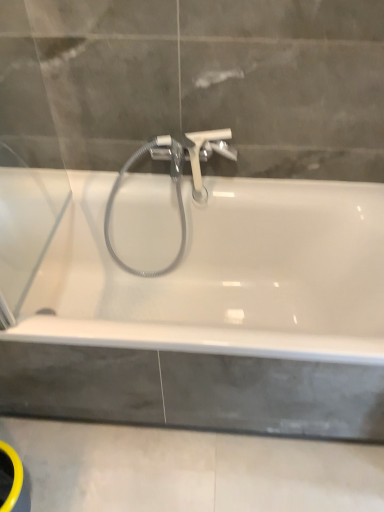
This screenshot has width=384, height=512. Describe the element at coordinates (208, 309) in the screenshot. I see `white glossy bathtub at center` at that location.

Describe the element at coordinates (190, 469) in the screenshot. I see `concreteroughbath edge at lower center` at that location.

The image size is (384, 512). I want to click on white glossy bathtub at center, so click(208, 309).

Is white glossy bathtub at center turned away from white plastic tap at center?

That's not correct — white glossy bathtub at center is not looking away from white plastic tap at center.

How far apart are white glossy bathtub at center and white plastic tap at center?

white glossy bathtub at center and white plastic tap at center are 45.91 centimeters apart from each other.

Is white glossy bathtub at center surrounding white plastic tap at center?

That's incorrect, white plastic tap at center is not inside white glossy bathtub at center.

From a real-world perspective, between white glossy bathtub at center and white plastic tap at center, who is vertically higher?

white plastic tap at center, from a real-world perspective.

Is concreteroughbath edge at lower center far from white plastic tap at center?

concreteroughbath edge at lower center is actually quite close to white plastic tap at center.

You are a GUI agent. You are given a task and a screenshot of the screen. Output one action in this format:
    pyautogui.click(x=<x>, y=<y>)
    Task: Click on the tap located behind the concreteroughbath edge at lower center
    
    Given the screenshot: What is the action you would take?
    pyautogui.click(x=194, y=153)

Measure the distance between concreteroughbath edge at lower center and white plastic tap at center.

concreteroughbath edge at lower center and white plastic tap at center are 36.32 inches apart from each other.

From the image's perspective, between concreteroughbath edge at lower center and white plastic tap at center, who is located below?

From the image's view, concreteroughbath edge at lower center is below.

Which is closer to the camera, (223, 139) or (194, 420)?

The point (194, 420) is closer to the camera.

Is white plastic tap at center not within white glossy bathtub at center?

white plastic tap at center lies outside white glossy bathtub at center's area.

How many degrees apart are the facing directions of white plastic tap at center and white glossy bathtub at center?

The facing directions of white plastic tap at center and white glossy bathtub at center are 3.67 degrees apart.

Considering the sizes of objects white plastic tap at center and white glossy bathtub at center in the image provided, who is thinner, white plastic tap at center or white glossy bathtub at center?

With smaller width is white plastic tap at center.

Is white glossy bathtub at center wider than concreteroughbath edge at lower center?

No, white glossy bathtub at center is not wider than concreteroughbath edge at lower center.

From the image's perspective, which one is positioned higher, white glossy bathtub at center or concreteroughbath edge at lower center?

From the image's view, white glossy bathtub at center is above.

Find the location of a particular element. concrete below the white plastic tap at center (from a real-world perspective) is located at coordinates (190, 469).

Which is in front, point (190, 139) or point (162, 473)?

The point (162, 473) is closer to the camera.

Measure the distance between white plastic tap at center and concreteroughbath edge at lower center.

The distance of white plastic tap at center from concreteroughbath edge at lower center is 36.32 inches.

Considering the relative sizes of white plastic tap at center and concreteroughbath edge at lower center in the image provided, is white plastic tap at center taller than concreteroughbath edge at lower center?

Correct, white plastic tap at center is much taller as concreteroughbath edge at lower center.

Considering their positions, is concreteroughbath edge at lower center located in front of or behind white glossy bathtub at center?

concreteroughbath edge at lower center is behind white glossy bathtub at center.

Can you confirm if concreteroughbath edge at lower center is bigger than white glossy bathtub at center?

Incorrect, concreteroughbath edge at lower center is not larger than white glossy bathtub at center.

Where is `bathtub in front of the concreteroughbath edge at lower center`? The height and width of the screenshot is (512, 384). bathtub in front of the concreteroughbath edge at lower center is located at coordinates (208, 309).

Is concreteroughbath edge at lower center positioned beyond the bounds of white glossy bathtub at center?

Yes, concreteroughbath edge at lower center is located beyond the bounds of white glossy bathtub at center.

You are a GUI agent. You are given a task and a screenshot of the screen. Output one action in this format:
    pyautogui.click(x=<x>, y=<y>)
    Task: Click on the bathtub to the left of white plastic tap at center
    
    Given the screenshot: What is the action you would take?
    pyautogui.click(x=208, y=309)

At what (x,y) coordinates should I click in order to perform the action: click on tap above the concreteroughbath edge at lower center (from the image's perspective). Please return your answer as a coordinate pair (x, y). Looking at the image, I should click on (194, 153).

Considering their positions, is concreteroughbath edge at lower center positioned closer to white glossy bathtub at center than white plastic tap at center?

concreteroughbath edge at lower center is positioned closer to the anchor white glossy bathtub at center.

Estimate the real-world distances between objects in this image. Which object is closer to white plastic tap at center, concreteroughbath edge at lower center or white glossy bathtub at center?

white glossy bathtub at center.

Consider the image. From the image, which object appears to be nearer to white glossy bathtub at center, white plastic tap at center or concreteroughbath edge at lower center?

Among the two, concreteroughbath edge at lower center is located nearer to white glossy bathtub at center.

Based on their spatial positions, is white glossy bathtub at center or concreteroughbath edge at lower center further from white plastic tap at center?

concreteroughbath edge at lower center is further to white plastic tap at center.

Based on their spatial positions, is white glossy bathtub at center or white plastic tap at center further from concreteroughbath edge at lower center?

white plastic tap at center is positioned further to the anchor concreteroughbath edge at lower center.

Based on their spatial positions, is white plastic tap at center or white glossy bathtub at center closer to concreteroughbath edge at lower center?

Among the two, white glossy bathtub at center is located nearer to concreteroughbath edge at lower center.

This screenshot has height=512, width=384. I want to click on bathtub between white plastic tap at center and concreteroughbath edge at lower center from top to bottom, so click(208, 309).